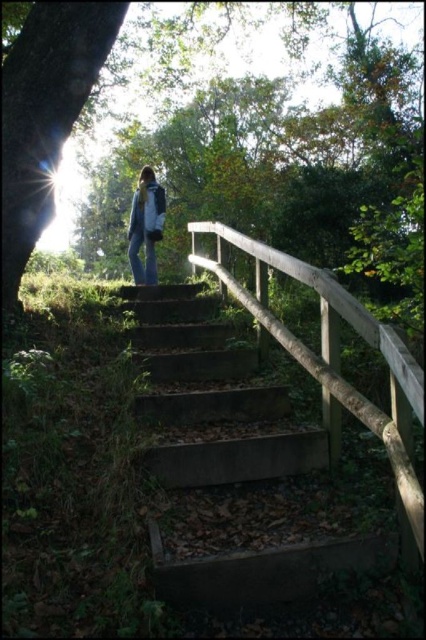
Question: Is smooth bark tree at left bigger than wooden textured rail at center?

Choices:
 (A) no
 (B) yes

Answer: (A)

Question: Which point is closer to the camera taking this photo?

Choices:
 (A) (400, 362)
 (B) (181, 124)
 (C) (172, 444)
 (D) (140, 282)

Answer: (A)

Question: Can you confirm if smooth bark tree at upper left is positioned above concrete stairs at center?

Choices:
 (A) yes
 (B) no

Answer: (A)

Question: Does smooth bark tree at left appear on the right side of wooden textured rail at center?

Choices:
 (A) yes
 (B) no

Answer: (B)

Question: Which point is farther to the camera?

Choices:
 (A) wooden textured rail at center
 (B) concrete stairs at center
 (C) denim jacket at center
 (D) smooth bark tree at upper left

Answer: (C)

Question: Based on their relative distances, which object is nearer to the smooth bark tree at upper left?

Choices:
 (A) concrete stairs at center
 (B) smooth bark tree at left

Answer: (B)